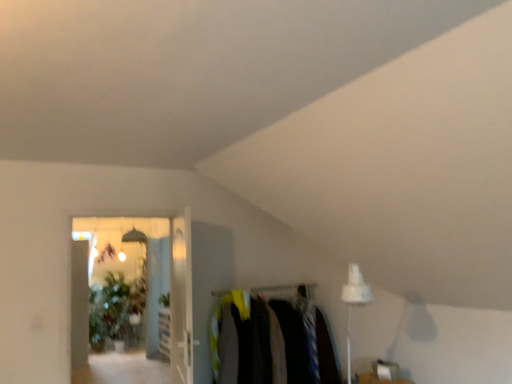
Question: Is dark fabric clothes at center in front of transparent glass door at center, acting as the 2th glass door starting from the right?

Choices:
 (A) no
 (B) yes

Answer: (A)

Question: Does dark fabric clothes at center appear on the right side of transparent glass door at center, acting as the first glass door starting from the left?

Choices:
 (A) no
 (B) yes

Answer: (B)

Question: From a real-world perspective, is dark fabric clothes at center positioned under transparent glass door at center, acting as the first glass door starting from the left, based on gravity?

Choices:
 (A) yes
 (B) no

Answer: (A)

Question: Considering the relative positions of dark fabric clothes at center and transparent glass door at center, acting as the first glass door starting from the left, in the image provided, is dark fabric clothes at center behind transparent glass door at center, acting as the first glass door starting from the left,?

Choices:
 (A) no
 (B) yes

Answer: (B)

Question: From the image's perspective, is dark fabric clothes at center below transparent glass door at center, acting as the 2th glass door starting from the right?

Choices:
 (A) yes
 (B) no

Answer: (A)

Question: Is dark fabric clothes at center not close to transparent glass door at center, acting as the first glass door starting from the left?

Choices:
 (A) no
 (B) yes

Answer: (B)

Question: Does green leafy plant at upper center lie in front of dark fabric clothes at center?

Choices:
 (A) no
 (B) yes

Answer: (A)

Question: Considering the relative sizes of green leafy plant at upper center and dark fabric clothes at center in the image provided, is green leafy plant at upper center bigger than dark fabric clothes at center?

Choices:
 (A) yes
 (B) no

Answer: (B)

Question: Does green leafy plant at upper center have a smaller size compared to dark fabric clothes at center?

Choices:
 (A) yes
 (B) no

Answer: (A)

Question: Is green leafy plant at upper center surrounding dark fabric clothes at center?

Choices:
 (A) no
 (B) yes

Answer: (A)

Question: From a real-world perspective, is green leafy plant at upper center physically below dark fabric clothes at center?

Choices:
 (A) yes
 (B) no

Answer: (B)

Question: Is green leafy plant at upper center oriented away from dark fabric clothes at center?

Choices:
 (A) yes
 (B) no

Answer: (B)

Question: Considering the relative sizes of clear glass door at center, which ranks as the first glass door in right-to-left order, and transparent glass door at center, acting as the first glass door starting from the left, in the image provided, is clear glass door at center, which ranks as the first glass door in right-to-left order, taller than transparent glass door at center, acting as the first glass door starting from the left,?

Choices:
 (A) yes
 (B) no

Answer: (B)